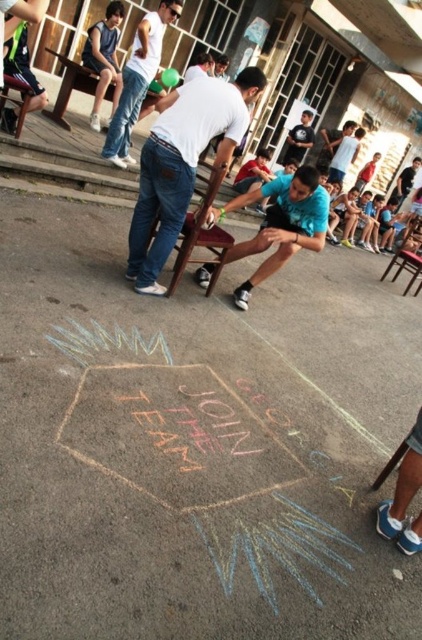
Is point (170, 92) positioned before point (16, 132)?

No, (170, 92) is behind (16, 132).

I want to click on white matte shirt at center, so click(183, 163).

What do you see at coordinates (183, 163) in the screenshot?
I see `white matte shirt at center` at bounding box center [183, 163].

Locate an element on the screen. The width and height of the screenshot is (422, 640). white matte shirt at center is located at coordinates (183, 163).

Who is higher up, brown wooden chair at center or wooden chair at left?

wooden chair at left is higher up.

What are the coordinates of `brown wooden chair at center` in the screenshot? It's located at (200, 228).

Is point (94, 61) positioned before point (413, 227)?

Yes.

Does point (99, 118) lie behind point (421, 268)?

Yes, point (99, 118) is farther from viewer.

Image resolution: width=422 pixels, height=640 pixels. I want to click on light blue denim shorts at upper left, so click(103, 58).